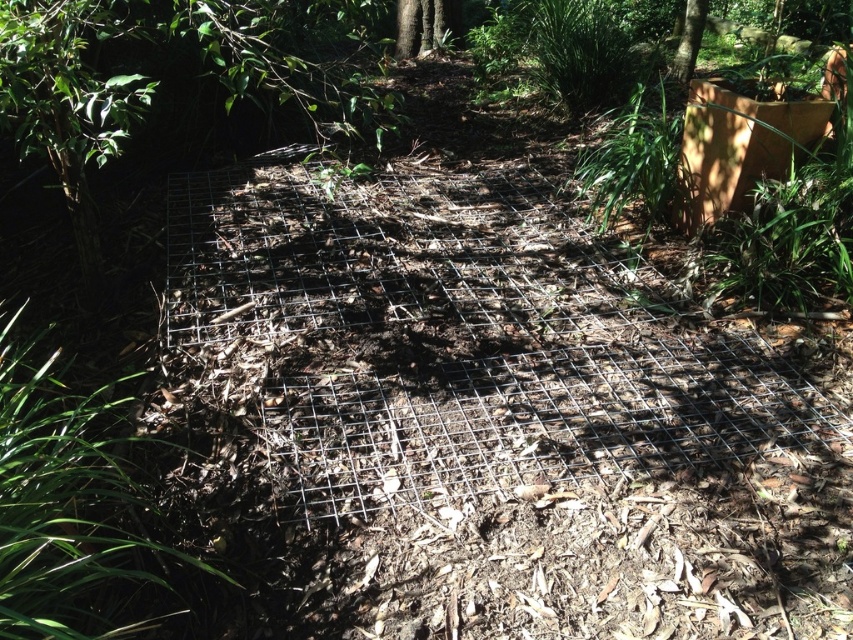
Is green grass at lower left wider than green textured tree trunk at upper center?

Yes.

Between green grass at lower left and green textured tree trunk at upper center, which one appears on the left side from the viewer's perspective?

A: Positioned to the left is green grass at lower left.

Between point (102, 634) and point (692, 26), which one is positioned behind?

Point (692, 26)

The width and height of the screenshot is (853, 640). Identify the location of green grass at lower left. (64, 500).